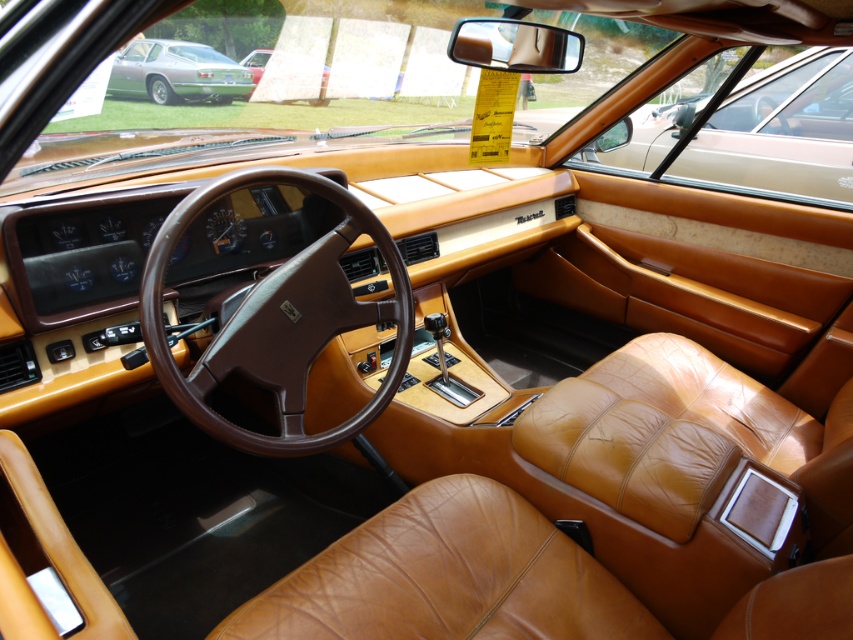
You are standing 5 feet away from the vintage car. If you want to reach the point at coordinates point (283, 422) inside the car, will you need to move closer or farther away?

The distance of point (283, 422) from viewer is 5.21 feet. Since you are currently 5 feet away, you need to move slightly closer to reach the point.

You are a passenger in the vintage car and want to look at the green matte sports car at upper left through the window. Can you see the brown leather steering wheel at center in your line of sight?

The brown leather steering wheel at center is positioned on the right side of green matte sports car at upper left, so when looking at the green matte sports car at upper left through the window, the brown leather steering wheel at center would block part of the view, making it difficult to see the entire car.

You are a passenger in the vintage car and want to look at the green matte sports car at upper left while keeping an eye on the brown leather steering wheel at center. Is the steering wheel in your direct line of sight to the sports car?

The brown leather steering wheel at center is located below the green matte sports car at upper left, so it would block your direct line of sight to the sports car.